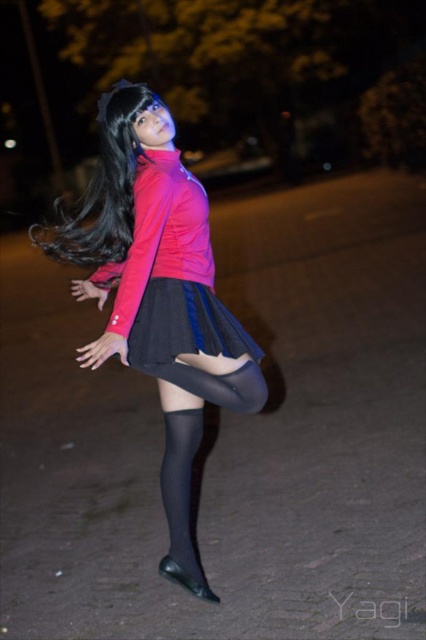
Between point (121, 161) and point (166, 560), which one is positioned behind?

Positioned behind is point (166, 560).

Is black silky hair at center shorter than black leather boot at lower center?

No.

You are a GUI agent. You are given a task and a screenshot of the screen. Output one action in this format:
    pyautogui.click(x=<x>, y=<y>)
    Task: Click on the black silky hair at center
    This screenshot has height=640, width=426.
    Given the screenshot: What is the action you would take?
    pyautogui.click(x=103, y=188)

At what (x,y) coordinates should I click in order to perform the action: click on black silky hair at center. Please return your answer as a coordinate pair (x, y). The height and width of the screenshot is (640, 426). Looking at the image, I should click on (103, 188).

Is matte pink jacket at center positioned in front of black leather boot at lower center?

That is True.

Between matte pink jacket at center and black leather boot at lower center, which one has more height?

matte pink jacket at center

Identify the location of matte pink jacket at center. (158, 289).

Does matte pink jacket at center have a lesser width compared to black silky hair at center?

In fact, matte pink jacket at center might be wider than black silky hair at center.

Does matte pink jacket at center have a larger size compared to black silky hair at center?

Indeed, matte pink jacket at center has a larger size compared to black silky hair at center.

Is point (201, 193) positioned before point (152, 102)?

No, it is not.

At what (x,y) coordinates should I click in order to perform the action: click on matte pink jacket at center. Please return your answer as a coordinate pair (x, y). The width and height of the screenshot is (426, 640). Looking at the image, I should click on (158, 289).